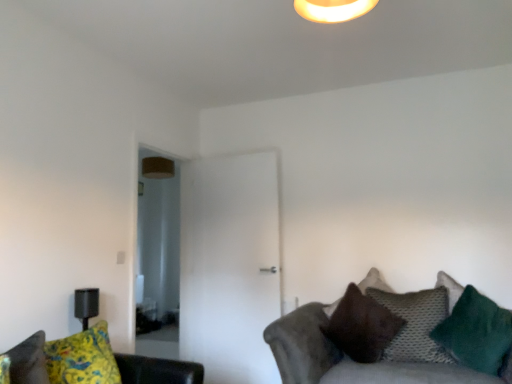
Question: Is knitted gray pillow at lower right, acting as the second pillow starting from the front, located outside textured gray couch at lower right, which is the second studio couch in left-to-right order?

Choices:
 (A) yes
 (B) no

Answer: (B)

Question: Considering the relative sizes of knitted gray pillow at lower right, acting as the second pillow starting from the front, and textured gray couch at lower right, the first studio couch viewed from the right, in the image provided, is knitted gray pillow at lower right, acting as the second pillow starting from the front, smaller than textured gray couch at lower right, the first studio couch viewed from the right,?

Choices:
 (A) yes
 (B) no

Answer: (A)

Question: From the image's perspective, does knitted gray pillow at lower right, which appears as the second pillow when viewed from the back, appear lower than textured gray couch at lower right, which is the second studio couch in left-to-right order?

Choices:
 (A) yes
 (B) no

Answer: (B)

Question: Can you confirm if knitted gray pillow at lower right, acting as the second pillow starting from the front, is bigger than textured gray couch at lower right, the first studio couch viewed from the right?

Choices:
 (A) yes
 (B) no

Answer: (B)

Question: Are knitted gray pillow at lower right, acting as the second pillow starting from the front, and textured gray couch at lower right, which is the second studio couch in left-to-right order, beside each other?

Choices:
 (A) no
 (B) yes

Answer: (A)

Question: Is knitted gray pillow at lower right, acting as the second pillow starting from the front, positioned far away from textured gray couch at lower right, which is the second studio couch in left-to-right order?

Choices:
 (A) no
 (B) yes

Answer: (A)

Question: Is yellow fabric couch at lower left, marked as the 2th studio couch in a right-to-left arrangement, positioned with its back to knitted gray pillow at lower right, acting as the second pillow starting from the front?

Choices:
 (A) no
 (B) yes

Answer: (A)

Question: From a real-world perspective, does yellow fabric couch at lower left, which is the first studio couch in left-to-right order, stand above knitted gray pillow at lower right, which appears as the second pillow when viewed from the back?

Choices:
 (A) yes
 (B) no

Answer: (A)

Question: Is the position of yellow fabric couch at lower left, marked as the 2th studio couch in a right-to-left arrangement, less distant than that of knitted gray pillow at lower right, acting as the second pillow starting from the front?

Choices:
 (A) no
 (B) yes

Answer: (B)

Question: Does yellow fabric couch at lower left, which is the first studio couch in left-to-right order, have a greater height compared to knitted gray pillow at lower right, which appears as the second pillow when viewed from the back?

Choices:
 (A) no
 (B) yes

Answer: (A)

Question: Considering the relative sizes of yellow fabric couch at lower left, marked as the 2th studio couch in a right-to-left arrangement, and knitted gray pillow at lower right, which appears as the second pillow when viewed from the back, in the image provided, is yellow fabric couch at lower left, marked as the 2th studio couch in a right-to-left arrangement, wider than knitted gray pillow at lower right, which appears as the second pillow when viewed from the back,?

Choices:
 (A) no
 (B) yes

Answer: (B)

Question: Is the depth of yellow fabric couch at lower left, which is the first studio couch in left-to-right order, greater than that of knitted gray pillow at lower right, acting as the second pillow starting from the front?

Choices:
 (A) yes
 (B) no

Answer: (B)

Question: Could you tell me if knitted gray pillow at lower right, acting as the second pillow starting from the front, is turned towards brown suede pillow at lower right, which is counted as the 1th pillow, starting from the back?

Choices:
 (A) no
 (B) yes

Answer: (A)